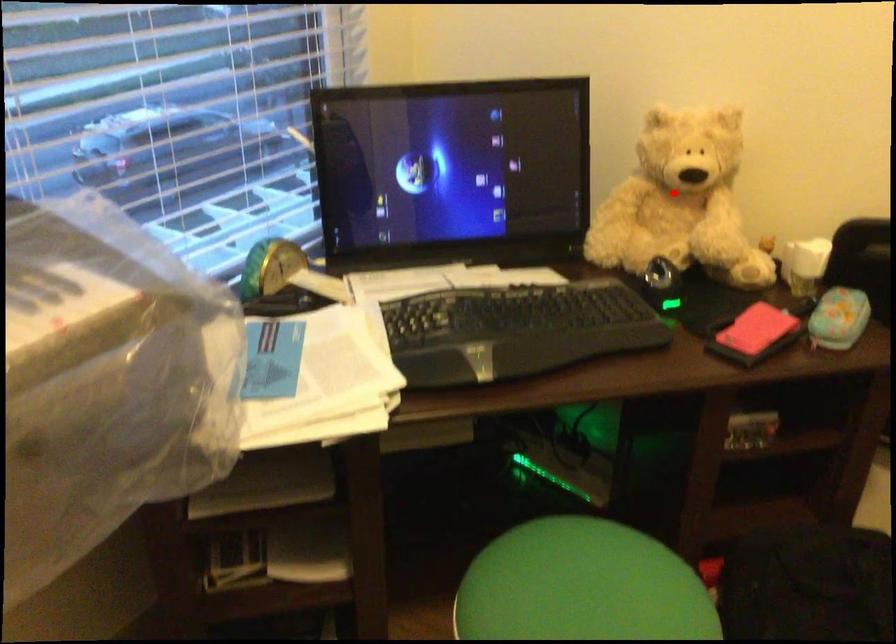
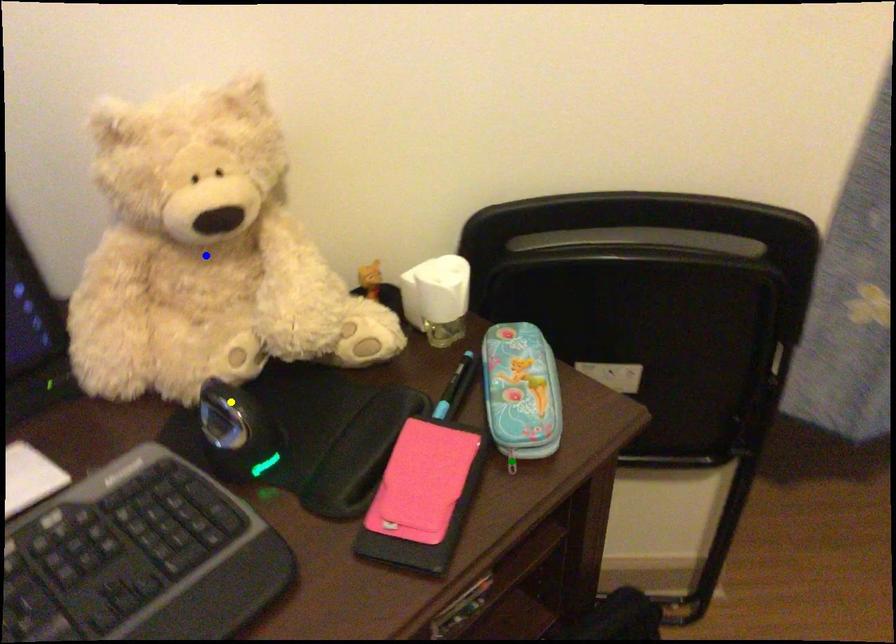
Question: I am providing you with two images of the same scene from different viewpoints. A red point is marked on the first image. You are given multiple points on the second image. Which mark in image 2 goes with the point in image 1?

Choices:
 (A) yellow point
 (B) green point
 (C) blue point

Answer: (C)